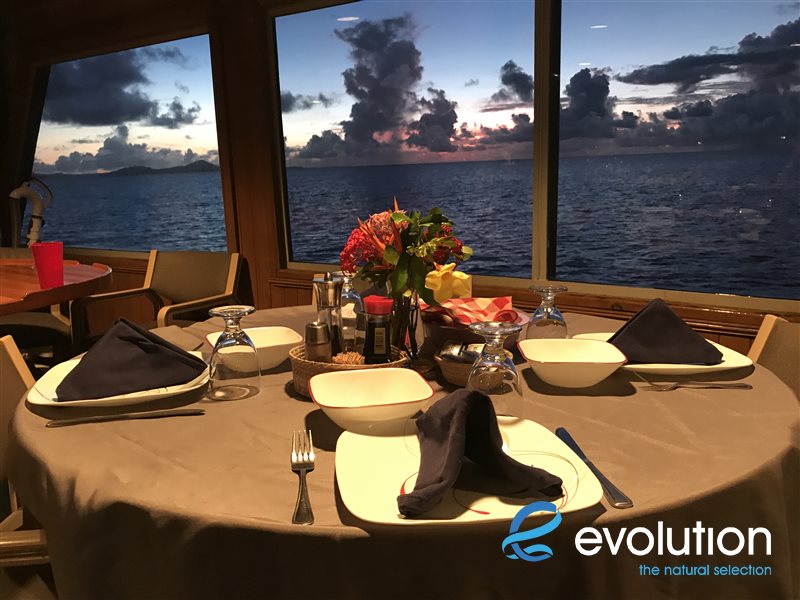
You are a GUI agent. You are given a task and a screenshot of the screen. Output one action in this format:
    pyautogui.click(x=<x>, y=<y>)
    Task: Click on the vase
    Image resolution: width=800 pixels, height=600 pixels.
    Given the screenshot: What is the action you would take?
    pyautogui.click(x=408, y=334), pyautogui.click(x=416, y=334)